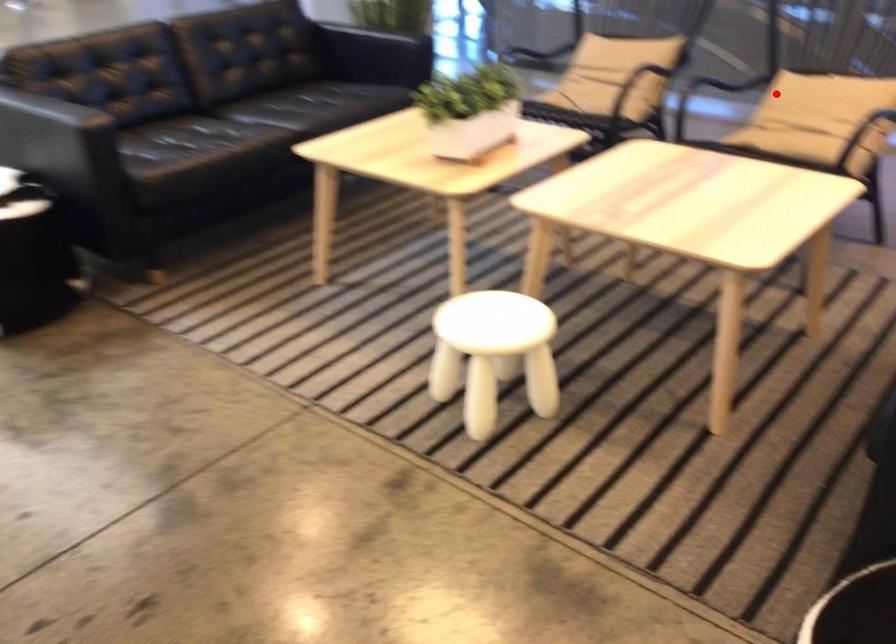
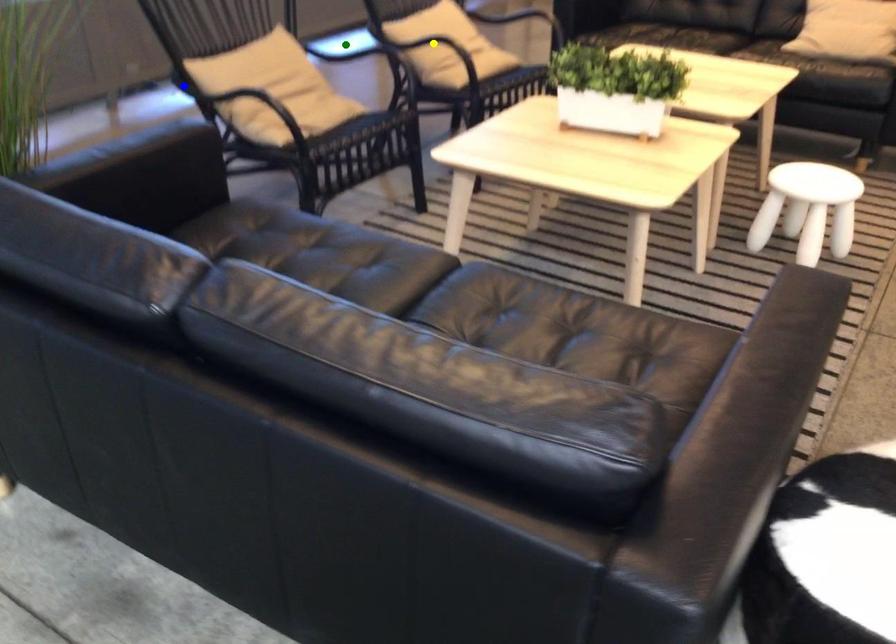
Question: I am providing you with two images of the same scene from different viewpoints. A red point is marked on the first image. You are given multiple points on the second image. Which point in image 2 is actually the same real-world point as the red point in image 1?

Choices:
 (A) green point
 (B) blue point
 (C) yellow point

Answer: (C)